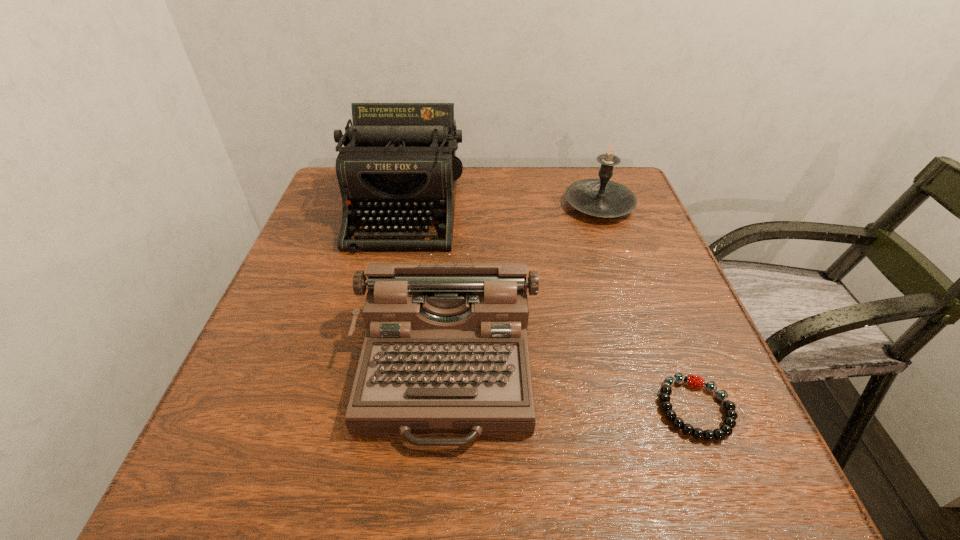
Identify the location of the taller typewriter. The height and width of the screenshot is (540, 960). (398, 163).

Where is `the farther typewriter`? The width and height of the screenshot is (960, 540). the farther typewriter is located at coordinates (398, 163).

The image size is (960, 540). Identify the location of candle. (601, 197).

This screenshot has height=540, width=960. In order to click on the nearer typewriter in this screenshot , I will do coord(446,352).

Locate an element on the screen. The width and height of the screenshot is (960, 540). bracelet is located at coordinates (726, 429).

Locate an element on the screen. free spot located 0.320m on the keyboard of the farther typewriter is located at coordinates (368, 378).

Find the location of `vacant area situated on the left of the candle`. vacant area situated on the left of the candle is located at coordinates (469, 205).

Locate an element on the screen. Image resolution: width=960 pixels, height=540 pixels. free spot located on the left of the shortest object is located at coordinates point(419,409).

Identify the location of typewriter at the far edge. 398,163.

The height and width of the screenshot is (540, 960). I want to click on candle at the far edge, so click(x=601, y=197).